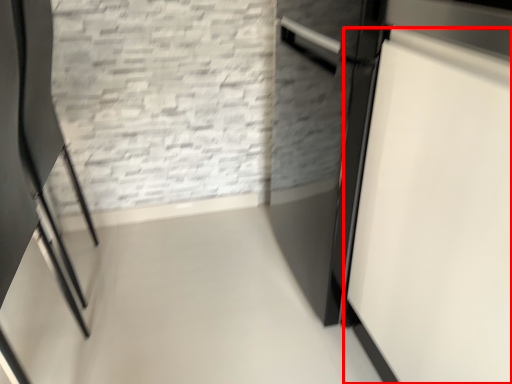
Question: Observing the image, what is the correct spatial positioning of door (annotated by the red box) in reference to chair?

Choices:
 (A) left
 (B) right

Answer: (B)